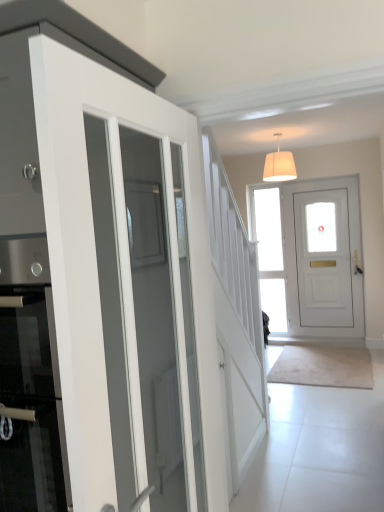
The height and width of the screenshot is (512, 384). Identify the location of white fabric lampshade at upper center. (279, 165).

What do you see at coordinates (269, 252) in the screenshot? The width and height of the screenshot is (384, 512). I see `clear glass door at center` at bounding box center [269, 252].

I want to click on white matte door at center, the 1th door viewed from the back, so click(x=323, y=257).

This screenshot has width=384, height=512. In order to click on white fabric lampshade at upper center in this screenshot , I will do `click(279, 165)`.

Can you confirm if white matte door at center, the second door from the left, is thinner than white fabric lampshade at upper center?

Yes, white matte door at center, the second door from the left, is thinner than white fabric lampshade at upper center.

Is white matte door at center, the 1th door viewed from the back, aimed at white fabric lampshade at upper center?

Yes, white matte door at center, the 1th door viewed from the back, is facing white fabric lampshade at upper center.

Considering the relative sizes of white matte door at center, the 1th door viewed from the back, and white fabric lampshade at upper center in the image provided, is white matte door at center, the 1th door viewed from the back, shorter than white fabric lampshade at upper center?

In fact, white matte door at center, the 1th door viewed from the back, may be taller than white fabric lampshade at upper center.

Is the depth of white matte door at center, the second door from the left, greater than that of white fabric lampshade at upper center?

Yes, it is behind white fabric lampshade at upper center.

Is white glossy door at left, which ranks as the 2th door in back-to-front order, closer to camera compared to clear glass door at center?

Yes, white glossy door at left, which ranks as the 2th door in back-to-front order, is closer to the camera.

How much distance is there between white glossy door at left, marked as the second door in a right-to-left arrangement, and clear glass door at center?

white glossy door at left, marked as the second door in a right-to-left arrangement, is 4.43 meters from clear glass door at center.

Which is more to the left, white glossy door at left, which is the 1th door from left to right, or clear glass door at center?

white glossy door at left, which is the 1th door from left to right, is more to the left.

Considering the relative sizes of white glossy door at left, arranged as the first door when viewed from the front, and clear glass door at center in the image provided, is white glossy door at left, arranged as the first door when viewed from the front, thinner than clear glass door at center?

No.

Which is behind, white fabric lampshade at upper center or white matte door at center, the 1th door viewed from the back?

white matte door at center, the 1th door viewed from the back, is more distant.

Is white fabric lampshade at upper center turned away from white matte door at center, the 1th door from the right?

No, white fabric lampshade at upper center's orientation is not away from white matte door at center, the 1th door from the right.

Is white fabric lampshade at upper center inside the boundaries of white matte door at center, the 1th door viewed from the back, or outside?

The correct answer is: outside.

Image resolution: width=384 pixels, height=512 pixels. Find the location of `lamp on the left side of white matte door at center, the 1th door viewed from the back`. lamp on the left side of white matte door at center, the 1th door viewed from the back is located at coordinates (279, 165).

Which of these two, clear glass door at center or white fabric lampshade at upper center, is bigger?

white fabric lampshade at upper center is bigger.

Is clear glass door at center aimed at white fabric lampshade at upper center?

Yes, clear glass door at center is oriented towards white fabric lampshade at upper center.

From a real-world perspective, is clear glass door at center below white fabric lampshade at upper center?

Yes, from a real-world perspective, clear glass door at center is below white fabric lampshade at upper center.

Between clear glass door at center and white fabric lampshade at upper center, which one appears on the right side from the viewer's perspective?

clear glass door at center is more to the right.

Is white matte door at center, the second door positioned from the front, far away from clear glass door at center?

white matte door at center, the second door positioned from the front, is near clear glass door at center, not far away.

Does white matte door at center, the 1th door viewed from the back, appear on the left side of clear glass door at center?

Incorrect, white matte door at center, the 1th door viewed from the back, is not on the left side of clear glass door at center.

How distant is white matte door at center, the 1th door viewed from the back, from clear glass door at center?

white matte door at center, the 1th door viewed from the back, and clear glass door at center are 17.17 inches apart.

From a real-world perspective, who is located lower, white matte door at center, the second door from the left, or clear glass door at center?

white matte door at center, the second door from the left, is physically lower.

Is clear glass door at center outside of white matte door at center, the second door positioned from the front?

Absolutely, clear glass door at center is external to white matte door at center, the second door positioned from the front.

Looking at this image, can you tell me how much clear glass door at center and white matte door at center, the second door from the left, differ in facing direction?

They differ by 0.0109 degrees in their facing directions.

Looking at the image, does clear glass door at center seem bigger or smaller compared to white matte door at center, the 1th door from the right?

In the image, clear glass door at center appears to be smaller than white matte door at center, the 1th door from the right.

Is clear glass door at center directly adjacent to white matte door at center, the 1th door viewed from the back?

No, clear glass door at center is not with white matte door at center, the 1th door viewed from the back.

Considering the sizes of objects clear glass door at center and white glossy door at left, which is the 1th door from left to right, in the image provided, who is bigger, clear glass door at center or white glossy door at left, which is the 1th door from left to right,?

white glossy door at left, which is the 1th door from left to right.

Is clear glass door at center closer to the viewer compared to white glossy door at left, which is the 1th door from left to right?

No, the depth of clear glass door at center is greater than that of white glossy door at left, which is the 1th door from left to right.

Is point (284, 276) farther from camera compared to point (191, 204)?

Yes.

Identify the location of lamp above the white matte door at center, the second door from the left (from the image's perspective). (279, 165).

Locate an element on the screen. door below the clear glass door at center (from the image's perspective) is located at coordinates (85, 240).

Estimate the real-world distances between objects in this image. Which object is closer to white glossy door at left, which ranks as the 2th door in back-to-front order, white fabric lampshade at upper center or white matte door at center, the second door from the left?

white fabric lampshade at upper center.

Based on their spatial positions, is white matte door at center, the 1th door from the right, or white fabric lampshade at upper center further from clear glass door at center?

The object further to clear glass door at center is white fabric lampshade at upper center.

Based on their spatial positions, is white glossy door at left, arranged as the first door when viewed from the front, or white matte door at center, the second door positioned from the front, closer to clear glass door at center?

Based on the image, white matte door at center, the second door positioned from the front, appears to be nearer to clear glass door at center.

Based on their spatial positions, is clear glass door at center or white fabric lampshade at upper center further from white matte door at center, the second door from the left?

Among the two, white fabric lampshade at upper center is located further to white matte door at center, the second door from the left.

Estimate the real-world distances between objects in this image. Which object is closer to white matte door at center, the second door from the left, white fabric lampshade at upper center or white glossy door at left, which is the 1th door from left to right?

white fabric lampshade at upper center is closer to white matte door at center, the second door from the left.

From the image, which object appears to be nearer to white matte door at center, the 1th door from the right, white fabric lampshade at upper center or clear glass door at center?

clear glass door at center is positioned closer to the anchor white matte door at center, the 1th door from the right.

When comparing their distances from clear glass door at center, does white glossy door at left, marked as the second door in a right-to-left arrangement, or white fabric lampshade at upper center seem closer?

Based on the image, white fabric lampshade at upper center appears to be nearer to clear glass door at center.

Estimate the real-world distances between objects in this image. Which object is closer to clear glass door at center, white fabric lampshade at upper center or white matte door at center, the second door positioned from the front?

white matte door at center, the second door positioned from the front, is positioned closer to the anchor clear glass door at center.

I want to click on lamp positioned between white glossy door at left, marked as the second door in a right-to-left arrangement, and clear glass door at center from near to far, so click(279, 165).

Find the location of a particular element. lamp located between white glossy door at left, marked as the second door in a right-to-left arrangement, and white matte door at center, the 1th door from the right, in the depth direction is located at coordinates (279, 165).

Locate an element on the screen. door located between white glossy door at left, which ranks as the 2th door in back-to-front order, and clear glass door at center in the depth direction is located at coordinates point(323,257).

Image resolution: width=384 pixels, height=512 pixels. Find the location of `door positioned between white fabric lampshade at upper center and clear glass door at center from near to far`. door positioned between white fabric lampshade at upper center and clear glass door at center from near to far is located at coordinates (323, 257).